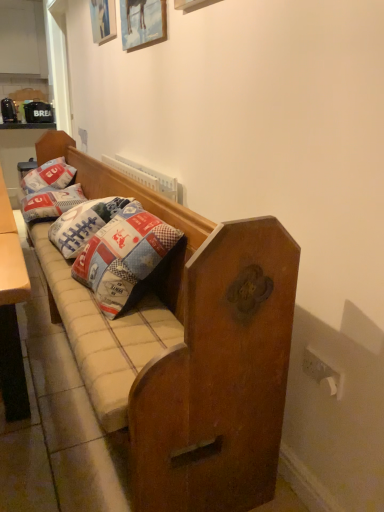
Question: Is wooden picture frame at upper center, which is the 2th picture frame from bottom to top, at the right side of wooden studio couch at center?

Choices:
 (A) yes
 (B) no

Answer: (A)

Question: Does wooden picture frame at upper center, which is the 2th picture frame from bottom to top, have a lesser height compared to wooden studio couch at center?

Choices:
 (A) yes
 (B) no

Answer: (A)

Question: Is wooden picture frame at upper center, the second picture frame viewed from the front, not near wooden studio couch at center?

Choices:
 (A) yes
 (B) no

Answer: (A)

Question: From the image's perspective, is wooden picture frame at upper center, marked as the first picture frame in a left-to-right arrangement, on top of wooden studio couch at center?

Choices:
 (A) no
 (B) yes

Answer: (B)

Question: Is wooden studio couch at center at the back of wooden picture frame at upper center, which is the 2th picture frame from bottom to top?

Choices:
 (A) yes
 (B) no

Answer: (B)

Question: Is point (112, 397) closer or farther from the camera than point (100, 36)?

Choices:
 (A) farther
 (B) closer

Answer: (B)

Question: Is wooden studio couch at center bigger or smaller than wooden picture frame at upper center, marked as the first picture frame in a left-to-right arrangement?

Choices:
 (A) big
 (B) small

Answer: (A)

Question: Is wooden studio couch at center situated inside wooden picture frame at upper center, which is the 1th picture frame from back to front, or outside?

Choices:
 (A) outside
 (B) inside

Answer: (A)

Question: Is wooden studio couch at center in front of or behind wooden picture frame at upper center, which is the 1th picture frame from back to front, in the image?

Choices:
 (A) front
 (B) behind

Answer: (A)

Question: Is patchwork fabric pillow at left, the second pillow in the front-to-back sequence, bigger or smaller than wooden picture frame at upper center, the 2th picture frame from the back?

Choices:
 (A) small
 (B) big

Answer: (B)

Question: Do you think patchwork fabric pillow at left, which is counted as the 1th pillow, starting from the back, is within wooden picture frame at upper center, the 2th picture frame from the back, or outside of it?

Choices:
 (A) outside
 (B) inside

Answer: (A)

Question: Is point (41, 169) closer or farther from the camera than point (145, 1)?

Choices:
 (A) farther
 (B) closer

Answer: (A)

Question: In terms of height, does patchwork fabric pillow at left, which is counted as the 1th pillow, starting from the back, look taller or shorter compared to wooden picture frame at upper center, marked as the second picture frame in a left-to-right arrangement?

Choices:
 (A) short
 (B) tall

Answer: (B)

Question: In terms of width, does patchwork fabric pillow at left, arranged as the 1th pillow when viewed from the front, look wider or thinner when compared to wooden picture frame at upper center, the 1th picture frame from the bottom?

Choices:
 (A) wide
 (B) thin

Answer: (A)

Question: Is patchwork fabric pillow at left, arranged as the 1th pillow when viewed from the front, situated inside wooden picture frame at upper center, which appears as the 2th picture frame when viewed from the top, or outside?

Choices:
 (A) outside
 (B) inside

Answer: (A)